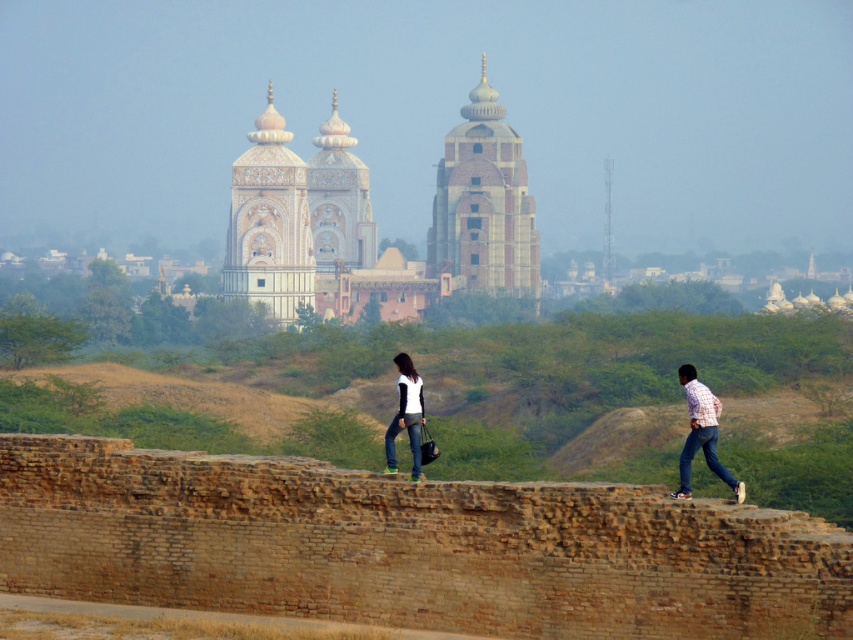
Which of these two, jeans at center or checkered shirt jeans at right, stands shorter?

checkered shirt jeans at right

Where is `jeans at center`? jeans at center is located at coordinates (701, 438).

Does checkered shirt jeans at right appear under matte white shirt at center?

Correct, checkered shirt jeans at right is located below matte white shirt at center.

Is point (720, 465) closer to viewer compared to point (416, 465)?

No, it is behind (416, 465).

You are a GUI agent. You are given a task and a screenshot of the screen. Output one action in this format:
    pyautogui.click(x=<x>, y=<y>)
    Task: Click on the checkered shirt jeans at right
    Image resolution: width=853 pixels, height=640 pixels.
    Given the screenshot: What is the action you would take?
    [x=701, y=435]

The image size is (853, 640). What are the coordinates of `checkered shirt jeans at right` in the screenshot? It's located at (701, 435).

Between jeans at center and matte white shirt at center, which one appears on the right side from the viewer's perspective?

jeans at center is more to the right.

From the picture: Can you confirm if jeans at center is positioned to the left of matte white shirt at center?

In fact, jeans at center is to the right of matte white shirt at center.

In order to click on jeans at center in this screenshot , I will do `click(701, 438)`.